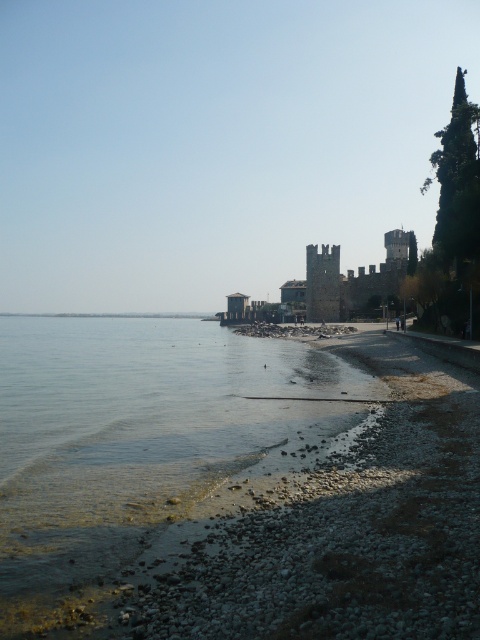
You are standing at the center of the paved pathway and want to reach the clear water at lower left. Which direction should you walk to get there?

You should walk towards the lower left direction to reach the clear water at lower left.

You are standing at the lakeside and want to cross to the other side. The clear water at lower left and the dark stone castle at center are in your view. Which one is wider from your perspective?

The clear water at lower left is wider than the dark stone castle at center from your perspective.

You are standing at the lakeside and want to cross to the other side. You see the clear water at lower left and the dark stone castle at center. Which object would you avoid stepping on?

You should avoid stepping on the dark stone castle at center because it is larger and the clear water at lower left is smaller, making the castle a solid structure.